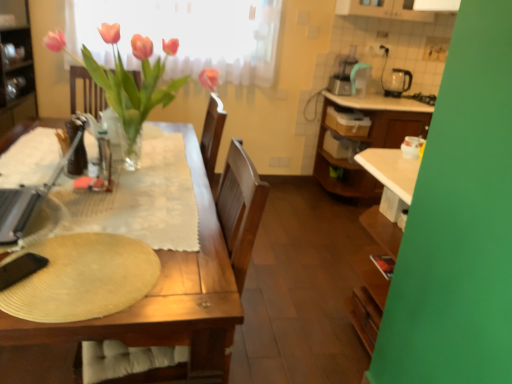
Identify the location of vacant region above beige textured paper plate at lower left (from a real-world perspective). (64, 280).